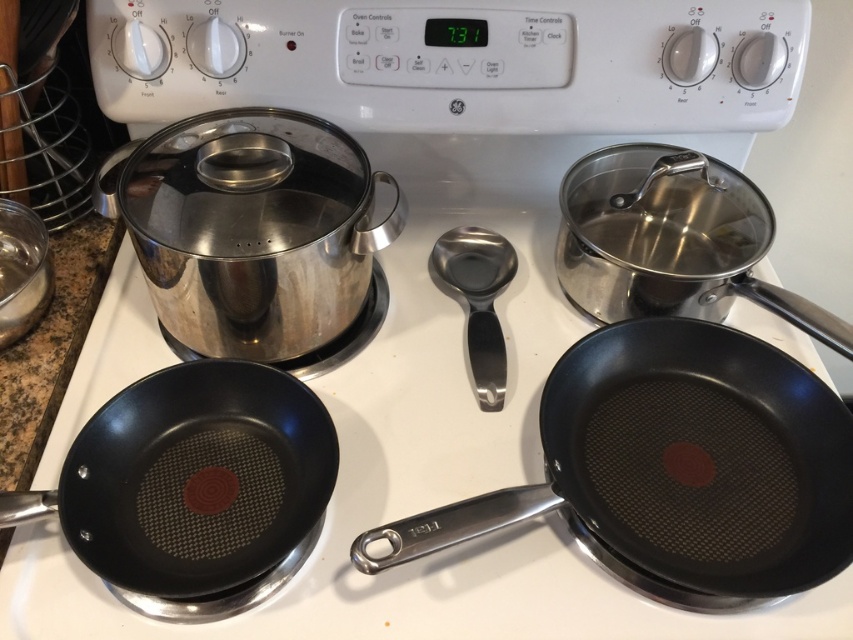
Does non-stick black frying pan at center have a larger size compared to non-stick black frying pan at lower left?

Correct, non-stick black frying pan at center is larger in size than non-stick black frying pan at lower left.

Locate an element on the screen. The height and width of the screenshot is (640, 853). non-stick black frying pan at center is located at coordinates (675, 468).

Measure the distance between non-stick black frying pan at center and camera.

20.38 inches

Locate an element on the screen. This screenshot has height=640, width=853. non-stick black frying pan at center is located at coordinates (675, 468).

Can you confirm if non-stick black frying pan at center is smaller than stainless steel measuring spoon at center?

No.

Can you confirm if non-stick black frying pan at center is positioned below stainless steel measuring spoon at center?

Indeed, non-stick black frying pan at center is positioned under stainless steel measuring spoon at center.

The height and width of the screenshot is (640, 853). What do you see at coordinates (675, 468) in the screenshot? I see `non-stick black frying pan at center` at bounding box center [675, 468].

I want to click on non-stick black frying pan at center, so click(675, 468).

Which is in front, point (212, 372) or point (467, 316)?

Point (212, 372) is in front.

Locate an element on the screen. This screenshot has width=853, height=640. non-stick black frying pan at lower left is located at coordinates (194, 488).